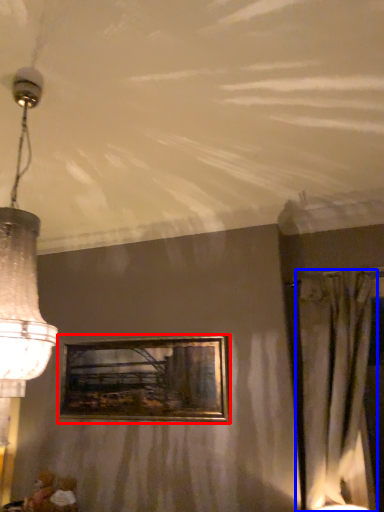
Question: Which point is further to the camera, picture frame (highlighted by a red box) or curtain (highlighted by a blue box)?

Choices:
 (A) picture frame
 (B) curtain

Answer: (A)